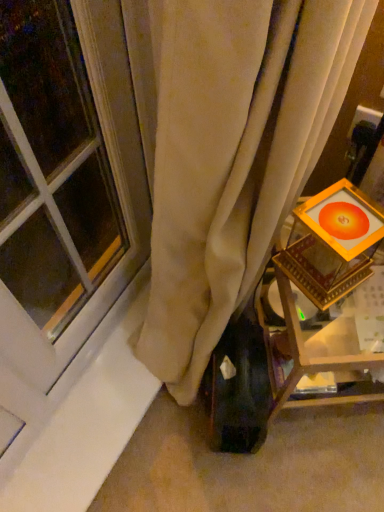
Question: Considering the relative positions of wooden framed picture at right and matte glass window at left in the image provided, is wooden framed picture at right to the left or to the right of matte glass window at left?

Choices:
 (A) right
 (B) left

Answer: (A)

Question: Do you think wooden framed picture at right is within matte glass window at left, or outside of it?

Choices:
 (A) outside
 (B) inside

Answer: (A)

Question: Considering the positions of wooden framed picture at right and matte glass window at left in the image, is wooden framed picture at right bigger or smaller than matte glass window at left?

Choices:
 (A) big
 (B) small

Answer: (A)

Question: Does point (142, 154) appear closer or farther from the camera than point (283, 305)?

Choices:
 (A) closer
 (B) farther

Answer: (B)

Question: From the image's perspective, is matte glass window at left positioned above or below wooden framed picture at right?

Choices:
 (A) above
 (B) below

Answer: (A)

Question: Choose the correct answer: Is matte glass window at left inside wooden framed picture at right or outside it?

Choices:
 (A) inside
 (B) outside

Answer: (B)

Question: Is matte glass window at left wider or thinner than wooden framed picture at right?

Choices:
 (A) wide
 (B) thin

Answer: (B)